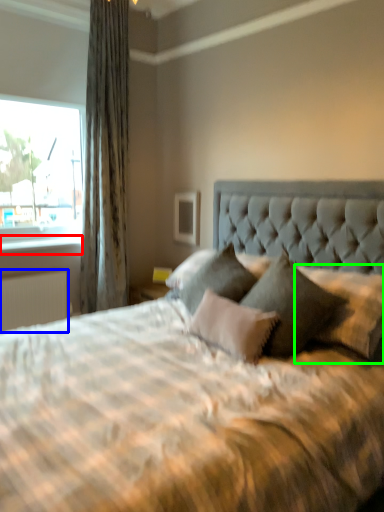
Question: Considering the real-world distances, which object is closest to window sill (highlighted by a red box)? radiator (highlighted by a blue box) or pillow (highlighted by a green box).

Choices:
 (A) radiator
 (B) pillow

Answer: (A)